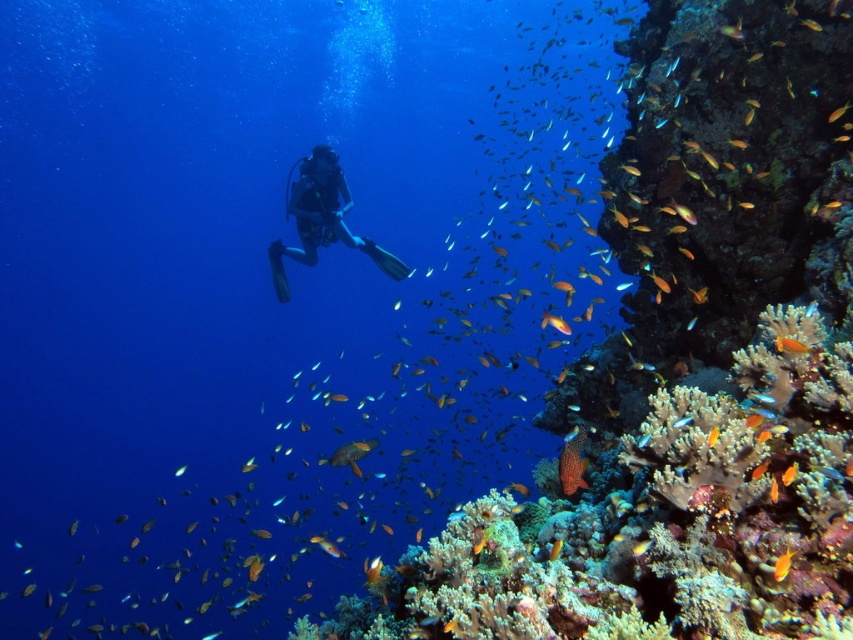
You are an underwater photographer aiming to capture a photo of the orange matte fish at lower right without the rough coral reef at right blocking the view. Based on their positions, can you position yourself in a way to frame the fish without the coral obstructing the shot?

The rough coral reef at right is to the right of the orange matte fish at lower right, so if you position yourself to the left side of the orange matte fish at lower right, you can frame the fish without the coral blocking the view.